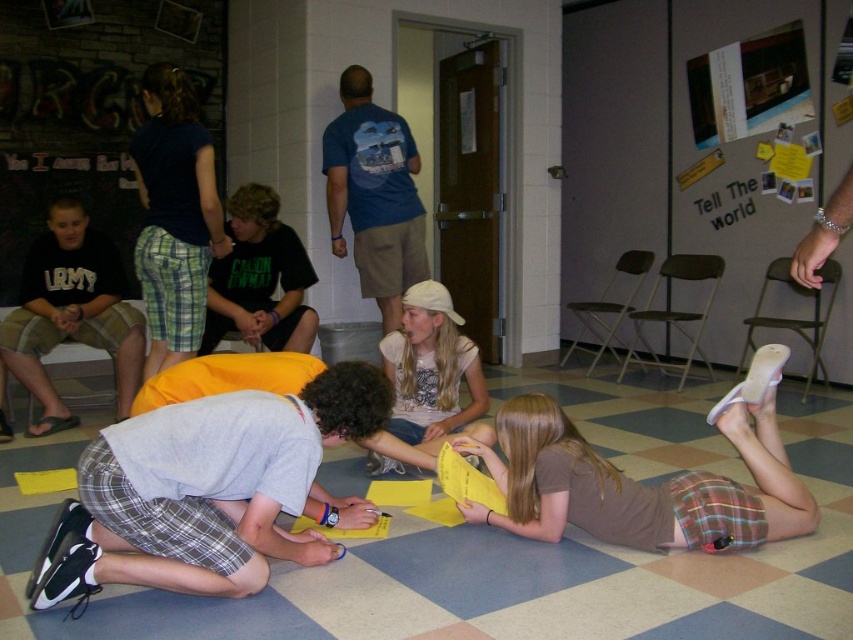
In the scene shown: Is army green shorts at left positioned at the back of white cotton shirt at center?

Yes, it is.

Is army green shorts at left thinner than white cotton shirt at center?

In fact, army green shorts at left might be wider than white cotton shirt at center.

Is point (125, 360) positioned in front of point (456, 320)?

No, it is not.

Image resolution: width=853 pixels, height=640 pixels. I want to click on army green shorts at left, so pos(71,314).